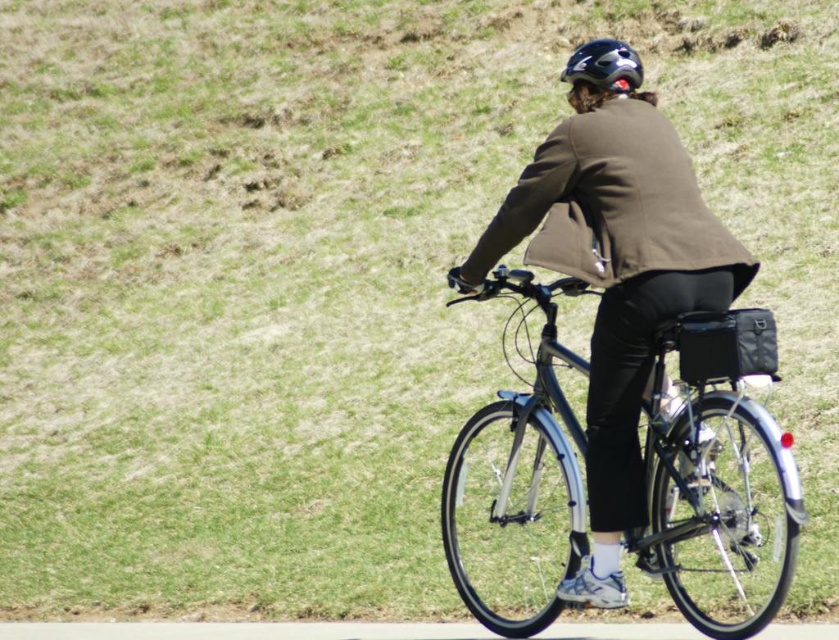
You are a photographer aiming to capture a clear photo of both the shiny metallic bicycle at center and the glossy black helmet at upper center. Since you want both objects in focus, which one should you adjust your camera focus to prioritize?

You should prioritize focusing on the glossy black helmet at upper center because it is farther away from the viewer compared to the shiny metallic bicycle at center, ensuring both are in focus by using the hyperfocal distance technique.

Consider the image. You are a photographer trying to capture the shiny metallic bicycle at center and the glossy black helmet at upper center in a single shot. Since the bicycle is smaller in the frame, which object should you focus on first to ensure both are in focus?

The shiny metallic bicycle at center occupies less space than the glossy black helmet at upper center, so you should focus on the glossy black helmet at upper center first to ensure both are in focus.

You are standing at the origin point of the coordinate system. You see a point at coordinate (714, 458). What object is located at that point?

The point at coordinate (714, 458) corresponds to the shiny metallic bicycle at center.